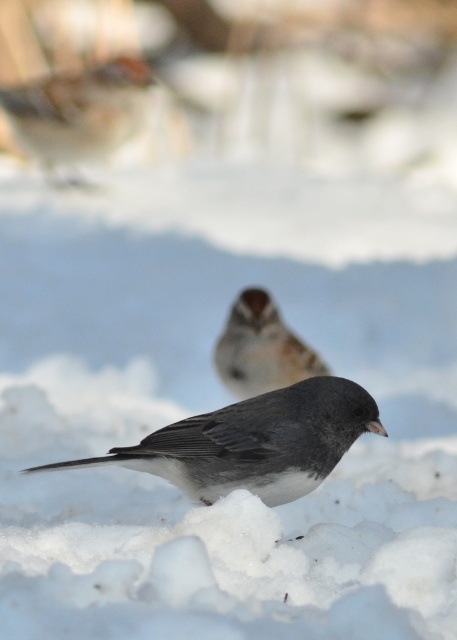
From the picture: You are a photographer aiming to capture a closeup shot of the dark gray matte bird at center. Given that your camera can focus on objects within a 0.1 unit radius around the center point of the image, which is at coordinates 0.5, 0.5, will the bird be in focus?

The dark gray matte bird at center is located at coordinates [254,442]. The distance from the center of the image is calculated as sqrt of squared differences between 0.692 and 0.5, and 0.556 and 0.5. This distance is approximately sqrt of 0.039 and 0.003, totaling sqrt of 0.042, which is about 0.205 units. Since this exceeds the 0.1 unit focus radius, the bird will not be in focus.

You are a photographer aiming to capture a closeup of the dark gray matte bird at center. Given that your camera has a focal length of 50mm and you are currently 2 meters away from the bird, would adjusting the focal length to 100mm allow you to achieve a closer focus without moving your position?

Adjusting the focal length to 100mm would double the magnification, allowing you to achieve a closer focus on the dark gray matte bird at center without moving your position.

You are a birdwatcher trying to identify two birds in the snowy landscape. You notice the brown speckled feathers at upper left and the brown speckled sparrow at center. Which of these has a greater width?

The brown speckled feathers at upper left has a greater width than the brown speckled sparrow at center.